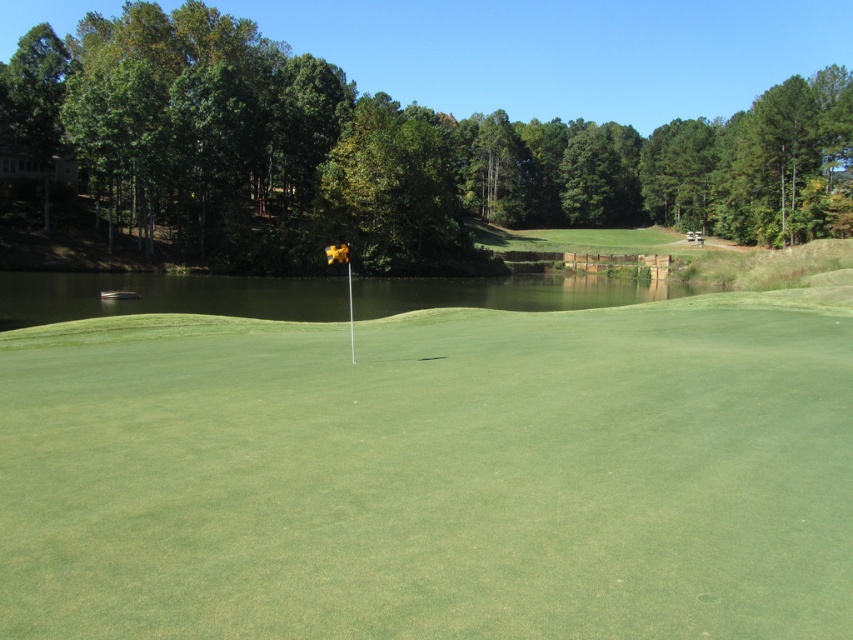
Looking at this image, you are a golfer standing on the green grassy golf course at center. You want to hit the ball towards the greenish water at center. Based on the scene description, will your ball land in the water or on the grass?

The green grassy golf course at center is in front of greenish water at center, so the ball would land on the grass before reaching the water.

You are a golfer standing on the green grassy golf course at center. You want to hit your golf ball towards the greenish water at center. Based on their heights, which object will the ball have to go over or under?

The green grassy golf course at center is not as tall as the greenish water at center. Since the golf ball must travel from a lower elevation to a higher one, it will need to go over the greenish water at center.